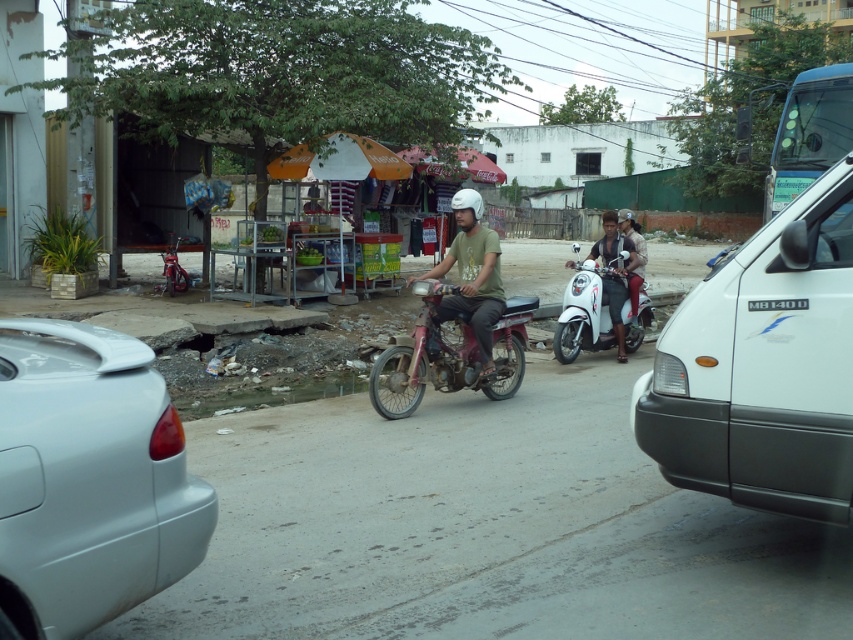
You are a delivery person who needs to park your motorcycle near the Coca Cola sign. The motorcycle you need to park is at point (x=448, y=355). Is there enough space between the rusty metal motorcycle at center and the Coca Cola sign to park your motorcycle?

The point (x=448, y=355) marks the rusty metal motorcycle at center. Therefore, there is no space between the rusty metal motorcycle at center and the Coca Cola sign to park your motorcycle because the motorcycle is already occupying that location.